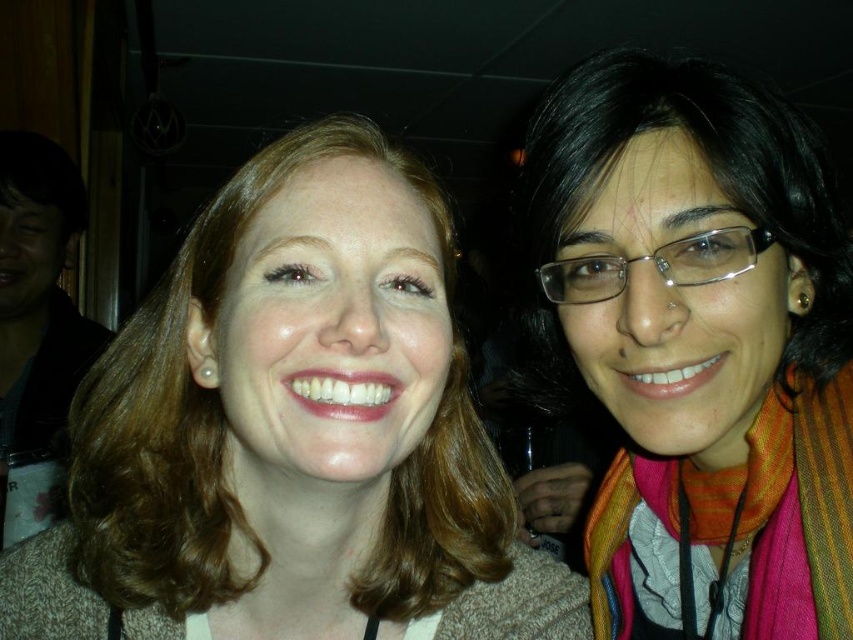
Which of these two, matte brown hair at center or multicolored scarf at right, stands shorter?

Standing shorter between the two is matte brown hair at center.

Does matte brown hair at center appear over multicolored scarf at right?

No, matte brown hair at center is not above multicolored scarf at right.

Image resolution: width=853 pixels, height=640 pixels. I want to click on matte brown hair at center, so click(x=291, y=433).

Is matte brown hair at center positioned behind multicolored woven scarf at right?

No, matte brown hair at center is in front of multicolored woven scarf at right.

Is point (248, 362) positioned in front of point (590, 582)?

Yes, it is.

Consider the image. Who is more forward, (119,483) or (610,480)?

Point (119,483) is in front.

This screenshot has height=640, width=853. In order to click on matte brown hair at center in this screenshot , I will do `click(291, 433)`.

Does multicolored scarf at right come in front of multicolored woven scarf at right?

Yes.

Is multicolored scarf at right above multicolored woven scarf at right?

Yes, multicolored scarf at right is above multicolored woven scarf at right.

What do you see at coordinates (699, 346) in the screenshot? I see `multicolored scarf at right` at bounding box center [699, 346].

In order to click on multicolored scarf at right in this screenshot , I will do `click(699, 346)`.